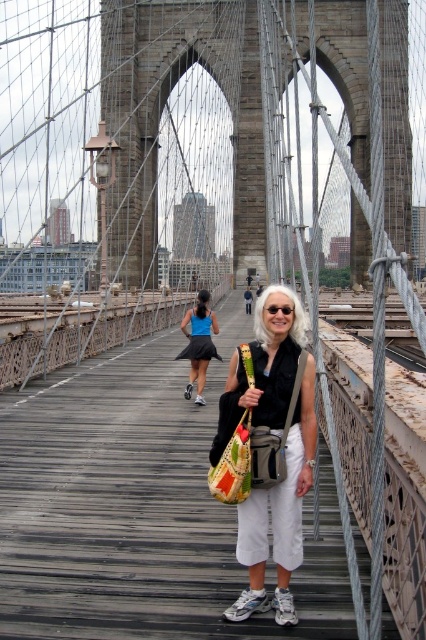
Question: Estimate the real-world distances between objects in this image. Which object is farther from the black plastic goggles at center?

Choices:
 (A) white cotton pants at center
 (B) blue fabric skirt at center

Answer: (B)

Question: Can you confirm if blue fabric skirt at center is wider than black plastic goggles at center?

Choices:
 (A) yes
 (B) no

Answer: (A)

Question: Which of the following is the farthest from the observer?

Choices:
 (A) (192, 364)
 (B) (287, 305)

Answer: (A)

Question: Among these points, which one is farthest from the camera?

Choices:
 (A) (259, 573)
 (B) (210, 323)
 (C) (281, 308)

Answer: (B)

Question: Is white cotton pants at center behind black plastic goggles at center?

Choices:
 (A) yes
 (B) no

Answer: (B)

Question: Is blue fabric skirt at center positioned in front of black plastic goggles at center?

Choices:
 (A) yes
 (B) no

Answer: (B)